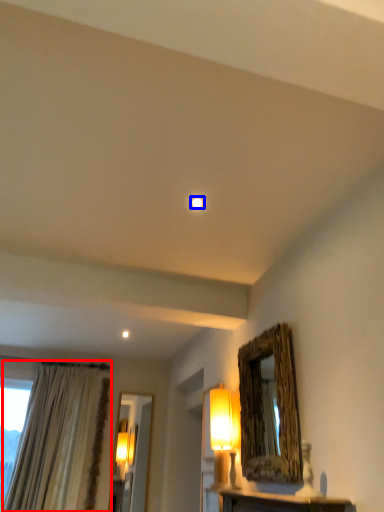
Question: Among these objects, which one is farthest to the camera, curtain (highlighted by a red box) or lighting (highlighted by a blue box)?

Choices:
 (A) curtain
 (B) lighting

Answer: (A)